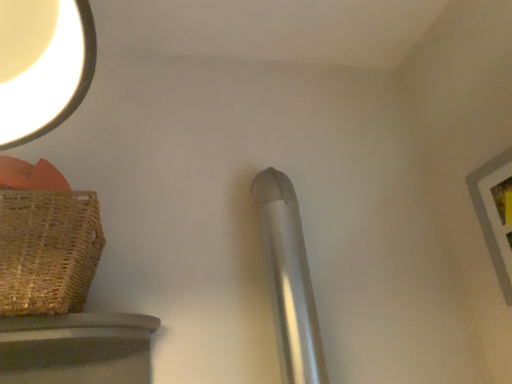
Question: Is brown woven basket at left bigger than wooden picture frame at upper right?

Choices:
 (A) yes
 (B) no

Answer: (A)

Question: Could you tell me if brown woven basket at left is turned towards wooden picture frame at upper right?

Choices:
 (A) no
 (B) yes

Answer: (A)

Question: Does brown woven basket at left have a smaller size compared to wooden picture frame at upper right?

Choices:
 (A) no
 (B) yes

Answer: (A)

Question: Considering the relative sizes of brown woven basket at left and wooden picture frame at upper right in the image provided, is brown woven basket at left thinner than wooden picture frame at upper right?

Choices:
 (A) yes
 (B) no

Answer: (B)

Question: Would you consider brown woven basket at left to be distant from wooden picture frame at upper right?

Choices:
 (A) no
 (B) yes

Answer: (A)

Question: From a real-world perspective, is wooden picture frame at upper right physically located above or below brown woven basket at left?

Choices:
 (A) above
 (B) below

Answer: (B)

Question: Considering the positions of wooden picture frame at upper right and brown woven basket at left in the image, is wooden picture frame at upper right wider or thinner than brown woven basket at left?

Choices:
 (A) wide
 (B) thin

Answer: (B)

Question: From the image's perspective, is wooden picture frame at upper right located above or below brown woven basket at left?

Choices:
 (A) below
 (B) above

Answer: (B)

Question: Do you think wooden picture frame at upper right is within brown woven basket at left, or outside of it?

Choices:
 (A) inside
 (B) outside

Answer: (B)

Question: Relative to wooden picture frame at upper right, is silver metallic pipe at center in front or behind?

Choices:
 (A) behind
 (B) front

Answer: (A)

Question: From the image's perspective, is silver metallic pipe at center positioned above or below wooden picture frame at upper right?

Choices:
 (A) above
 (B) below

Answer: (B)

Question: In the image, is silver metallic pipe at center on the left side or the right side of wooden picture frame at upper right?

Choices:
 (A) right
 (B) left

Answer: (B)

Question: From a real-world perspective, is silver metallic pipe at center positioned above or below wooden picture frame at upper right?

Choices:
 (A) below
 (B) above

Answer: (A)

Question: Is point (271, 233) closer or farther from the camera than point (66, 268)?

Choices:
 (A) closer
 (B) farther

Answer: (B)

Question: Considering the relative positions of silver metallic pipe at center and brown woven basket at left in the image provided, is silver metallic pipe at center to the left or to the right of brown woven basket at left?

Choices:
 (A) left
 (B) right

Answer: (B)